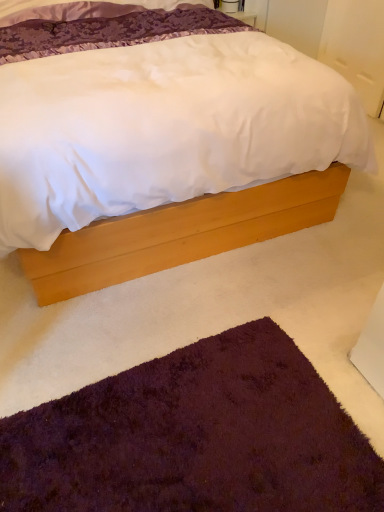
The width and height of the screenshot is (384, 512). Describe the element at coordinates (179, 234) in the screenshot. I see `light wood bed at center` at that location.

Where is `light wood bed at center`? This screenshot has height=512, width=384. light wood bed at center is located at coordinates (179, 234).

What is the approximate width of purple shaggy rug at lower left?

The width of purple shaggy rug at lower left is 28.11 inches.

The height and width of the screenshot is (512, 384). What do you see at coordinates (195, 437) in the screenshot?
I see `purple shaggy rug at lower left` at bounding box center [195, 437].

Where is `purple shaggy rug at lower left`? The width and height of the screenshot is (384, 512). purple shaggy rug at lower left is located at coordinates (195, 437).

Find the location of a particular element. light wood bed at center is located at coordinates (179, 234).

Between purple shaggy rug at lower left and light wood bed at center, which one appears on the right side from the viewer's perspective?

purple shaggy rug at lower left.

Considering the positions of objects purple shaggy rug at lower left and light wood bed at center in the image provided, who is behind, purple shaggy rug at lower left or light wood bed at center?

purple shaggy rug at lower left is further from the camera.

Does point (254, 350) come in front of point (191, 211)?

Yes, it is in front of point (191, 211).

From the image's perspective, is purple shaggy rug at lower left beneath light wood bed at center?

Correct, purple shaggy rug at lower left appears lower than light wood bed at center in the image.

From a real-world perspective, is purple shaggy rug at lower left physically above light wood bed at center?

Incorrect, from a real-world perspective, purple shaggy rug at lower left is lower than light wood bed at center.

Is purple shaggy rug at lower left wider than light wood bed at center?

No, purple shaggy rug at lower left is not wider than light wood bed at center.

Consider the image. Is purple shaggy rug at lower left taller or shorter than light wood bed at center?

purple shaggy rug at lower left is shorter than light wood bed at center.

Can you confirm if purple shaggy rug at lower left is bigger than light wood bed at center?

Actually, purple shaggy rug at lower left might be smaller than light wood bed at center.

Is purple shaggy rug at lower left surrounding light wood bed at center?

No.

Are purple shaggy rug at lower left and light wood bed at center far apart?

No, purple shaggy rug at lower left is not far away from light wood bed at center.

Is purple shaggy rug at lower left aimed at light wood bed at center?

Yes.

What's the angular difference between purple shaggy rug at lower left and light wood bed at center's facing directions?

There is a 180-degree angle between the facing directions of purple shaggy rug at lower left and light wood bed at center.

This screenshot has height=512, width=384. I want to click on bed in front of the purple shaggy rug at lower left, so click(x=179, y=234).

Is light wood bed at center at the left side of purple shaggy rug at lower left?

Yes, light wood bed at center is to the left of purple shaggy rug at lower left.

Does light wood bed at center come in front of purple shaggy rug at lower left?

Yes, it is in front of purple shaggy rug at lower left.

Which is closer to the camera, (281, 215) or (196, 462)?

The point (196, 462) is closer to the camera.

From the image's perspective, which is below, light wood bed at center or purple shaggy rug at lower left?

purple shaggy rug at lower left is shown below in the image.

From a real-world perspective, is light wood bed at center positioned above or below purple shaggy rug at lower left?

light wood bed at center is above purple shaggy rug at lower left.

Which of these two, light wood bed at center or purple shaggy rug at lower left, is wider?

light wood bed at center.

Is light wood bed at center shorter than purple shaggy rug at lower left?

No, light wood bed at center is not shorter than purple shaggy rug at lower left.

Looking at the image, does light wood bed at center seem bigger or smaller compared to purple shaggy rug at lower left?

Clearly, light wood bed at center is larger in size than purple shaggy rug at lower left.

Is light wood bed at center not inside purple shaggy rug at lower left?

Yes, light wood bed at center is outside of purple shaggy rug at lower left.

Based on the photo, is light wood bed at center directly adjacent to purple shaggy rug at lower left?

light wood bed at center is not next to purple shaggy rug at lower left, and they're not touching.

Is light wood bed at center facing towards purple shaggy rug at lower left?

Yes, light wood bed at center is aimed at purple shaggy rug at lower left.

What's the angular difference between light wood bed at center and purple shaggy rug at lower left's facing directions?

The facing directions of light wood bed at center and purple shaggy rug at lower left are 180 degrees apart.

Measure the distance between light wood bed at center and purple shaggy rug at lower left.

They are 26.40 inches apart.

Where is `bed positioned vertically above the purple shaggy rug at lower left (from a real-world perspective)`? bed positioned vertically above the purple shaggy rug at lower left (from a real-world perspective) is located at coordinates (179, 234).

Where is `doormat below the light wood bed at center (from a real-world perspective)`? doormat below the light wood bed at center (from a real-world perspective) is located at coordinates (195, 437).

I want to click on doormat located behind the light wood bed at center, so click(195, 437).